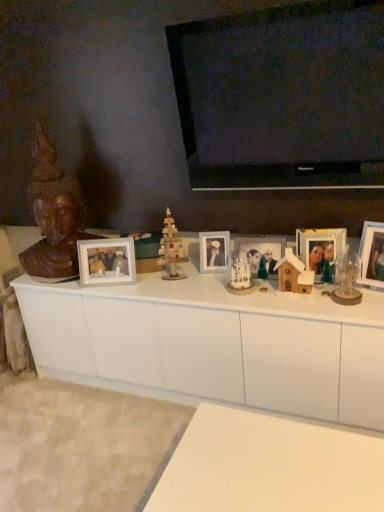
Question: From the image's perspective, is white ceramic snowman at center, the 2th toy from the right, positioned above or below white matte picture frame at center, marked as the fifth picture frame in a right-to-left arrangement?

Choices:
 (A) below
 (B) above

Answer: (A)

Question: Is white ceramic snowman at center, the 2th toy from the right, taller or shorter than white matte picture frame at center, placed as the 1th picture frame when sorted from left to right?

Choices:
 (A) short
 (B) tall

Answer: (A)

Question: Which is nearer to the matte glass photo frame at center, positioned as the 2th picture frame in left-to-right order?

Choices:
 (A) matte glass photo frame at center right, the 4th picture frame viewed from the left
 (B) white ceramic snowman at center, the 2th toy from the right
 (C) wooden christmas tree at center, arranged as the first toy when viewed from the left
 (D) wooden statue at left
 (E) white matte cabinet at center

Answer: (B)

Question: Which of these objects is positioned closest to the matte glass photo frame at center, positioned as the 2th picture frame in left-to-right order?

Choices:
 (A) white wooden house at center, the 3th toy when ordered from left to right
 (B) wooden photo frame at right, the 1th picture frame when ordered from right to left
 (C) white ceramic snowman at center, the 2th toy from the right
 (D) white matte cabinet at center
 (E) matte glass photo frame at center right, the 4th picture frame viewed from the left

Answer: (C)